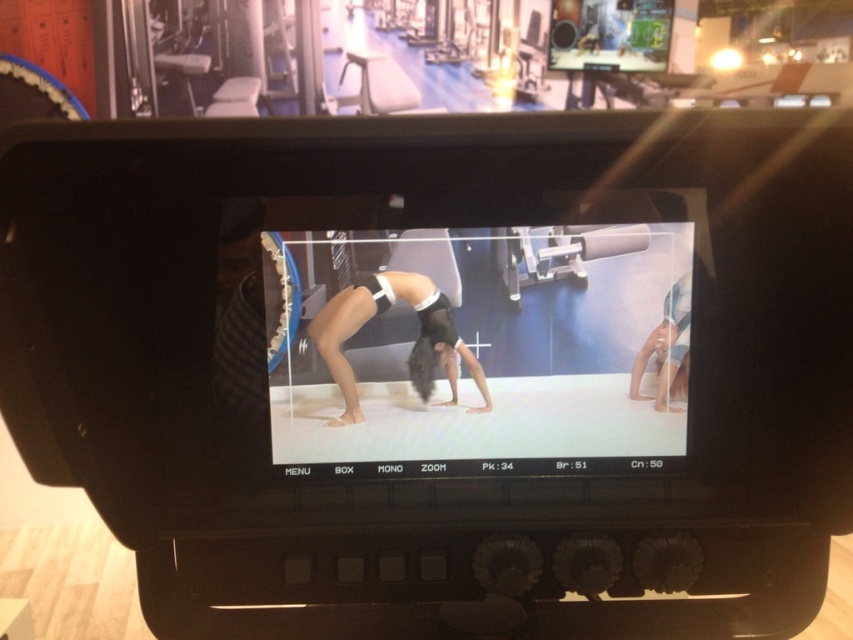
Question: Considering the relative positions of black matte yoga mat at center and black matte hair at center in the image provided, where is black matte yoga mat at center located with respect to black matte hair at center?

Choices:
 (A) right
 (B) left

Answer: (A)

Question: Does black matte yoga mat at center have a lesser width compared to smooth skin at lower right?

Choices:
 (A) no
 (B) yes

Answer: (A)

Question: Which point is farther to the camera?

Choices:
 (A) (430, 394)
 (B) (451, 339)
 (C) (674, 340)

Answer: (A)

Question: Which object appears closest to the camera in this image?

Choices:
 (A) black matte yoga mat at center
 (B) smooth skin at lower right
 (C) black matte hair at center

Answer: (A)

Question: Observing the image, what is the correct spatial positioning of black matte hair at center in reference to smooth skin at lower right?

Choices:
 (A) right
 (B) left

Answer: (B)

Question: Which is nearer to the smooth skin at lower right?

Choices:
 (A) black matte hair at center
 (B) black matte yoga mat at center

Answer: (B)